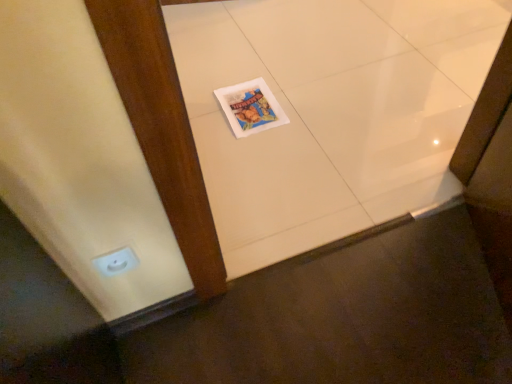
Question: Can you confirm if white glossy tile at center is bigger than white glossy electric outlet at lower left?

Choices:
 (A) yes
 (B) no

Answer: (A)

Question: From the image's perspective, is white glossy tile at center under white glossy electric outlet at lower left?

Choices:
 (A) yes
 (B) no

Answer: (B)

Question: Can we say white glossy tile at center lies outside white glossy electric outlet at lower left?

Choices:
 (A) yes
 (B) no

Answer: (A)

Question: Would you say white glossy electric outlet at lower left is part of white glossy tile at center's contents?

Choices:
 (A) yes
 (B) no

Answer: (B)

Question: Does white glossy tile at center have a greater height compared to white glossy electric outlet at lower left?

Choices:
 (A) yes
 (B) no

Answer: (B)

Question: From the image's perspective, is white glossy tile at center on white glossy electric outlet at lower left?

Choices:
 (A) no
 (B) yes

Answer: (B)

Question: Is white glossy electric outlet at lower left looking in the opposite direction of matte paper magazine at center?

Choices:
 (A) yes
 (B) no

Answer: (B)

Question: From a real-world perspective, does white glossy electric outlet at lower left sit lower than matte paper magazine at center?

Choices:
 (A) yes
 (B) no

Answer: (B)

Question: Is white glossy electric outlet at lower left not within matte paper magazine at center?

Choices:
 (A) no
 (B) yes

Answer: (B)

Question: Is there a large distance between white glossy electric outlet at lower left and matte paper magazine at center?

Choices:
 (A) yes
 (B) no

Answer: (B)

Question: Is white glossy electric outlet at lower left shorter than matte paper magazine at center?

Choices:
 (A) no
 (B) yes

Answer: (A)

Question: Is white glossy electric outlet at lower left surrounding matte paper magazine at center?

Choices:
 (A) no
 (B) yes

Answer: (A)

Question: Are white glossy tile at center and matte paper magazine at center far apart?

Choices:
 (A) yes
 (B) no

Answer: (B)